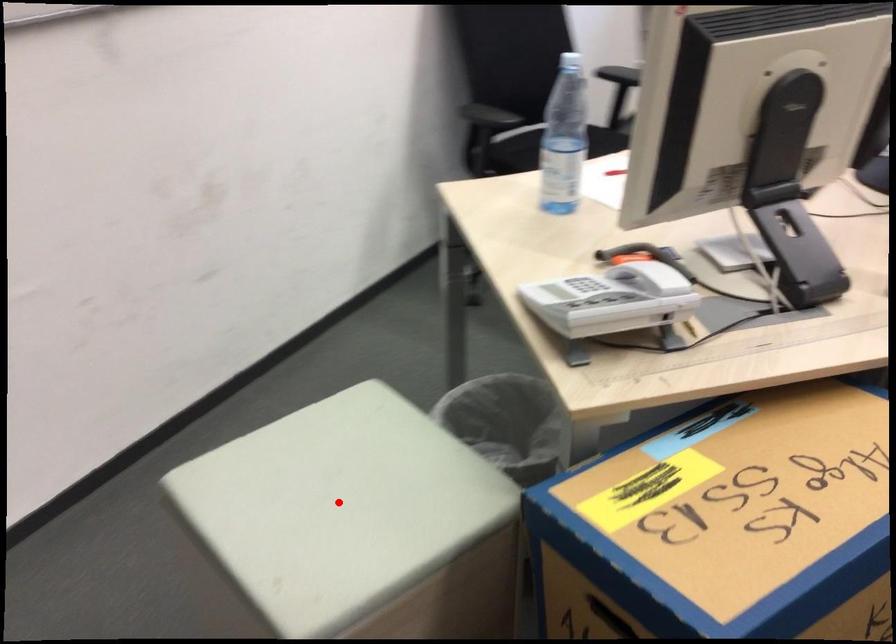
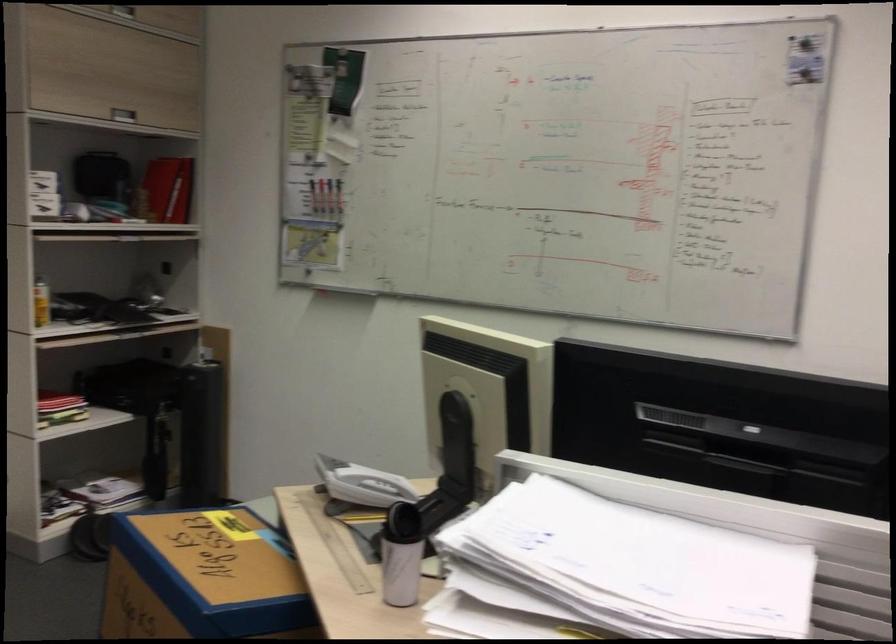
Question: I am providing you with two images of the same scene from different viewpoints. A red point is marked on the first image. Can you still see the location of the red point in image 2?

Choices:
 (A) Yes
 (B) No

Answer: (B)